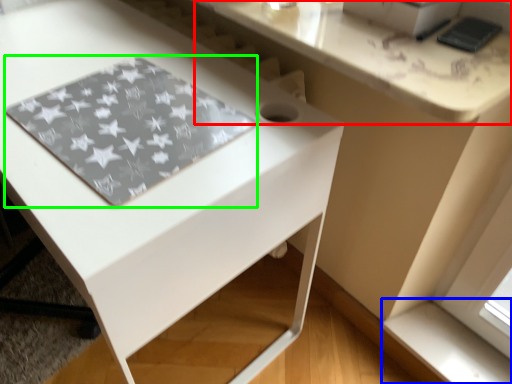
Question: Which object is the farthest from counter top (highlighted by a red box)? Choose among these: window sill (highlighted by a blue box) or mat (highlighted by a green box).

Choices:
 (A) window sill
 (B) mat

Answer: (A)